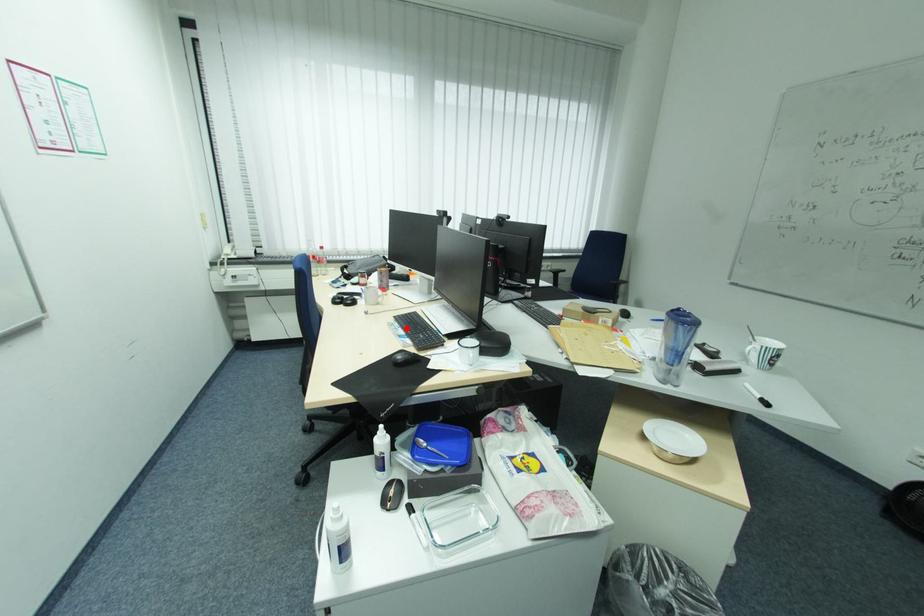
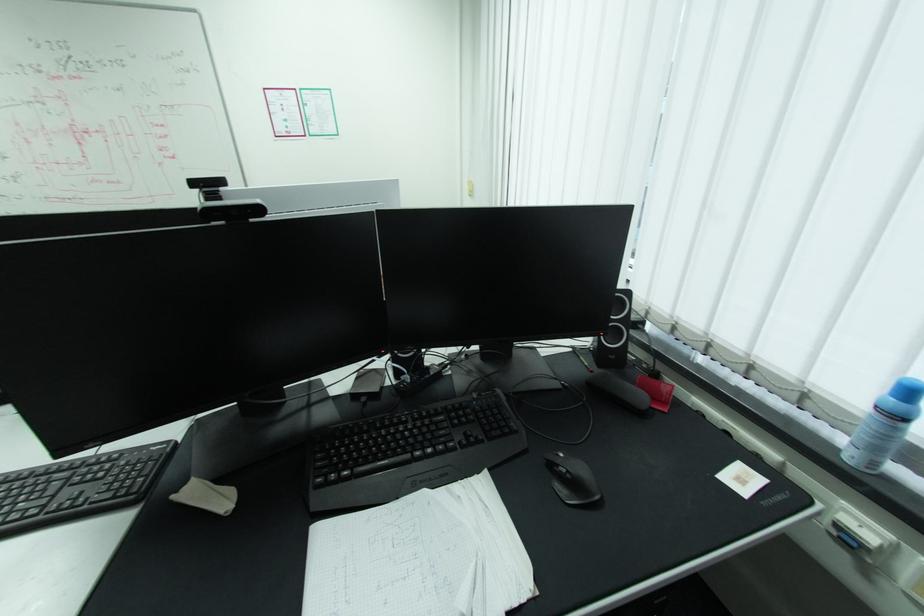
Question: I am providing you with two images of the same scene from different viewpoints. A red point is marked on the first image. Can you still see the location of the red point in image 2?

Choices:
 (A) Yes
 (B) No

Answer: (B)